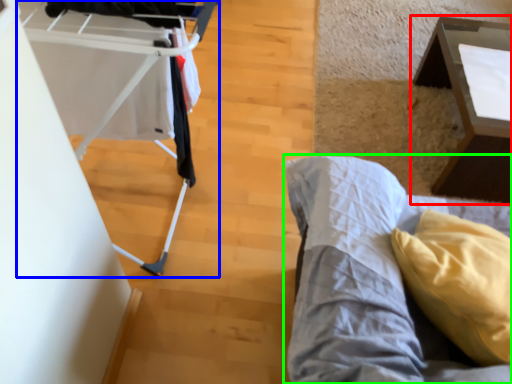
Question: Based on their relative distances, which object is nearer to table (highlighted by a red box)? Choose from baby carriage (highlighted by a blue box) and furniture (highlighted by a green box).

Choices:
 (A) baby carriage
 (B) furniture

Answer: (B)